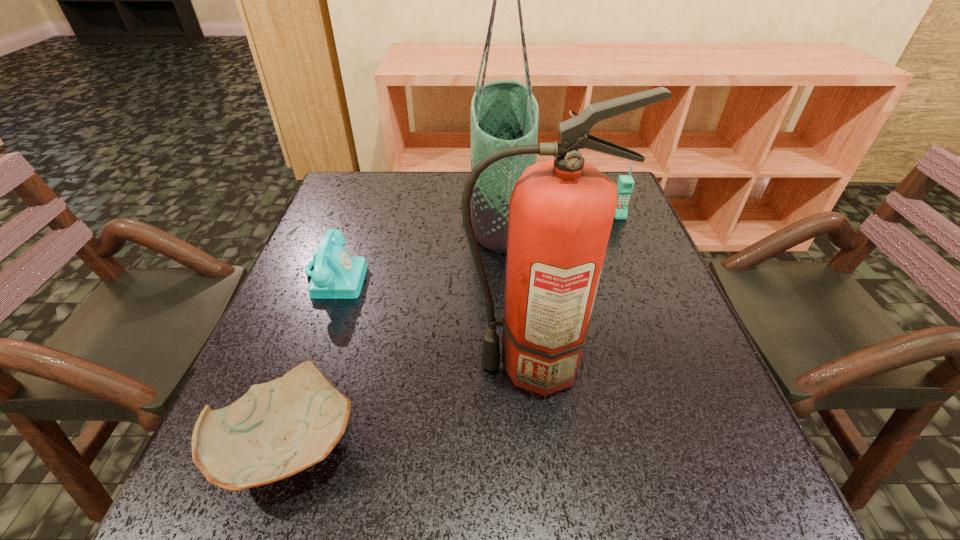
Where is `object at the far right corner`? This screenshot has height=540, width=960. object at the far right corner is located at coordinates (625, 184).

You are a GUI agent. You are given a task and a screenshot of the screen. Output one action in this format:
    pyautogui.click(x=<x>, y=<y>)
    Task: Click on the free space at the far edge of the desktop
    
    Given the screenshot: What is the action you would take?
    pyautogui.click(x=412, y=180)

At what (x,y) coordinates should I click in order to perform the action: click on free space at the near edge of the desktop. Please return your answer as a coordinate pair (x, y). This screenshot has height=540, width=960. Looking at the image, I should click on (377, 507).

Locate an element on the screen. Image resolution: width=960 pixels, height=540 pixels. vacant space at the left edge of the desktop is located at coordinates (360, 220).

In the image, there is a desktop. Where is `free region at the right edge`? free region at the right edge is located at coordinates (636, 254).

Locate an element on the screen. Image resolution: width=960 pixels, height=540 pixels. vacant region at the near right corner of the desktop is located at coordinates (681, 505).

At what (x,y) coordinates should I click in order to perform the action: click on vacant area that lies between the fire extinguisher and the telephone. Please return your answer as a coordinate pair (x, y). The width and height of the screenshot is (960, 540). Looking at the image, I should click on (433, 321).

The height and width of the screenshot is (540, 960). Find the location of `free spot between the tote bag and the telephone`. free spot between the tote bag and the telephone is located at coordinates (418, 245).

Locate an element on the screen. free spot between the fourth tallest object and the shortest object is located at coordinates (313, 360).

I want to click on free space between the fire extinguisher and the second shortest object, so click(433, 321).